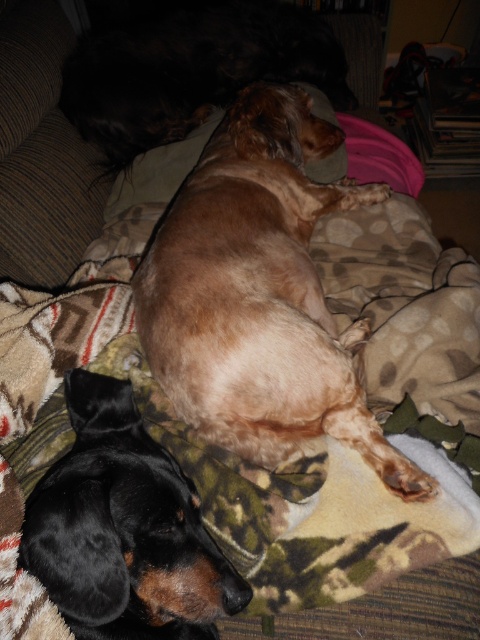
Question: Where is black smooth dog at lower left located in relation to brown fur dog at upper center in the image?

Choices:
 (A) above
 (B) below

Answer: (B)

Question: Among these objects, which one is farthest from the camera?

Choices:
 (A) brown fur dog at upper center
 (B) black smooth dog at lower left

Answer: (A)

Question: Does black smooth dog at lower left have a smaller size compared to brown fur dog at upper center?

Choices:
 (A) yes
 (B) no

Answer: (A)

Question: Estimate the real-world distances between objects in this image. Which object is closer to the black smooth dog at lower left?

Choices:
 (A) light brown fur at center
 (B) brown fur dog at upper center

Answer: (A)

Question: Is light brown fur at center to the right of black smooth dog at lower left from the viewer's perspective?

Choices:
 (A) yes
 (B) no

Answer: (A)

Question: Considering the real-world distances, which object is closest to the light brown fur at center?

Choices:
 (A) black smooth dog at lower left
 (B) brown fur dog at upper center

Answer: (A)